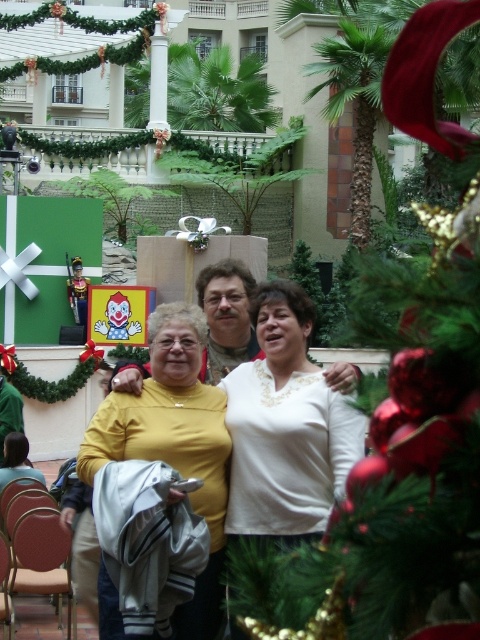
Can you confirm if white matte sweater at center is positioned above yellow matte shirt at center?

Yes, white matte sweater at center is above yellow matte shirt at center.

Consider the image. Which of these two, white matte sweater at center or yellow matte shirt at center, stands taller?

With more height is white matte sweater at center.

Is point (266, 467) positioned before point (194, 346)?

Yes, it is.

What are the coordinates of `white matte sweater at center` in the screenshot? It's located at (286, 426).

Who is higher up, white matte sweater at center or yellow knit sweater at center?

Positioned higher is yellow knit sweater at center.

Can you confirm if white matte sweater at center is thinner than yellow knit sweater at center?

Correct, white matte sweater at center's width is less than yellow knit sweater at center's.

This screenshot has width=480, height=640. What do you see at coordinates (286, 426) in the screenshot?
I see `white matte sweater at center` at bounding box center [286, 426].

At what (x,y) coordinates should I click in order to perform the action: click on white matte sweater at center. Please return your answer as a coordinate pair (x, y). The image size is (480, 640). Looking at the image, I should click on (286, 426).

Can you confirm if yellow matte shirt at center is positioned to the left of yellow knit sweater at center?

Yes, yellow matte shirt at center is to the left of yellow knit sweater at center.

Does yellow matte shirt at center have a lesser width compared to yellow knit sweater at center?

Yes, yellow matte shirt at center is thinner than yellow knit sweater at center.

Describe the element at coordinates (173, 442) in the screenshot. This screenshot has width=480, height=640. I see `yellow matte shirt at center` at that location.

Find the location of a particular element. yellow matte shirt at center is located at coordinates (173, 442).